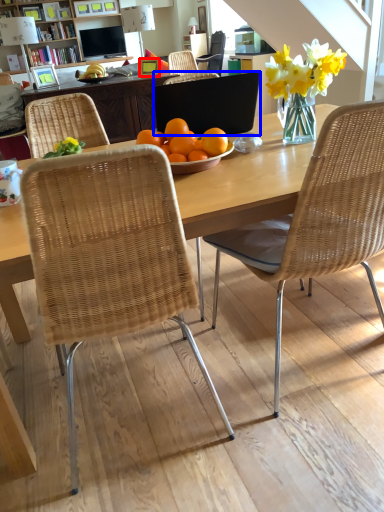
Question: Which object is closer to the camera taking this photo, picture frame (highlighted by a red box) or laptop (highlighted by a blue box)?

Choices:
 (A) picture frame
 (B) laptop

Answer: (B)